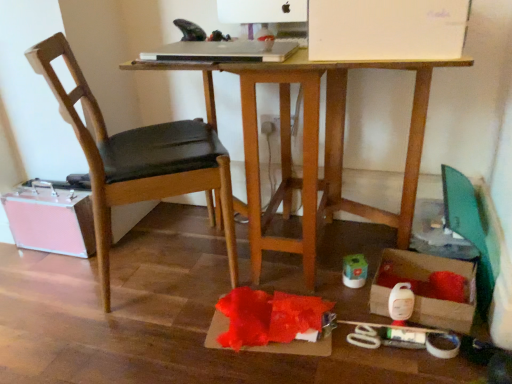
Locate an element on the screen. This screenshot has height=384, width=512. vacant space in front of black leather chair at left is located at coordinates (133, 343).